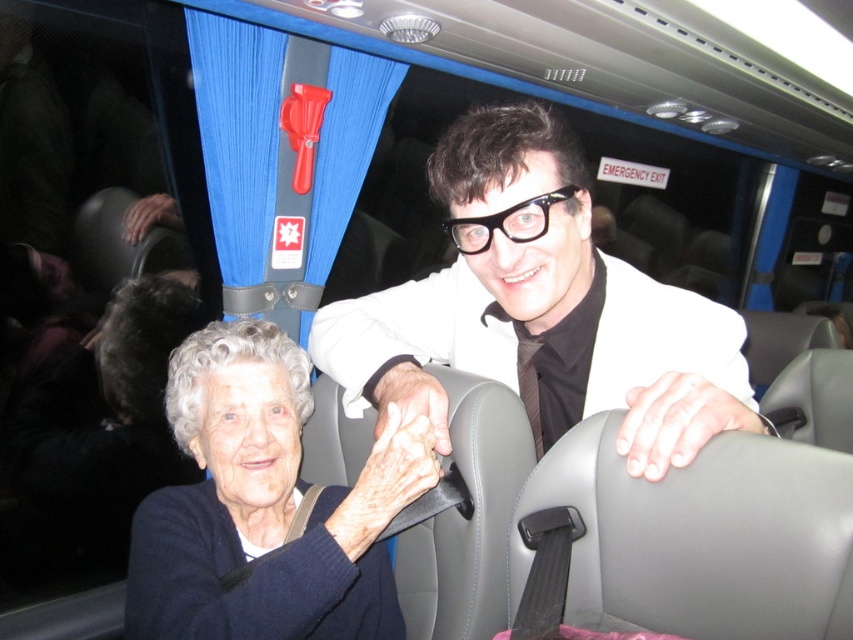
Is white glossy suit at center above dark blue sweater at lower left?

Correct, white glossy suit at center is located above dark blue sweater at lower left.

This screenshot has height=640, width=853. I want to click on white glossy suit at center, so click(x=541, y=310).